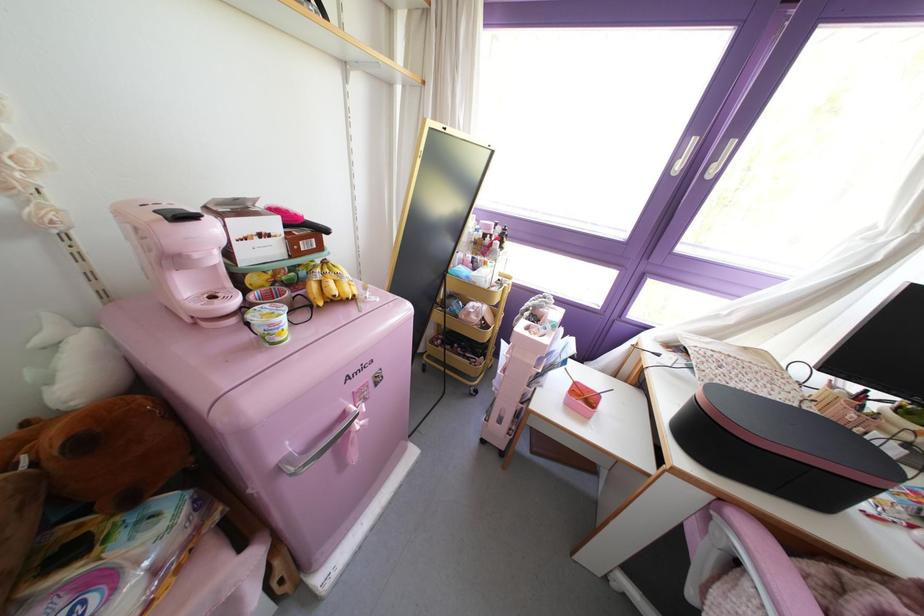
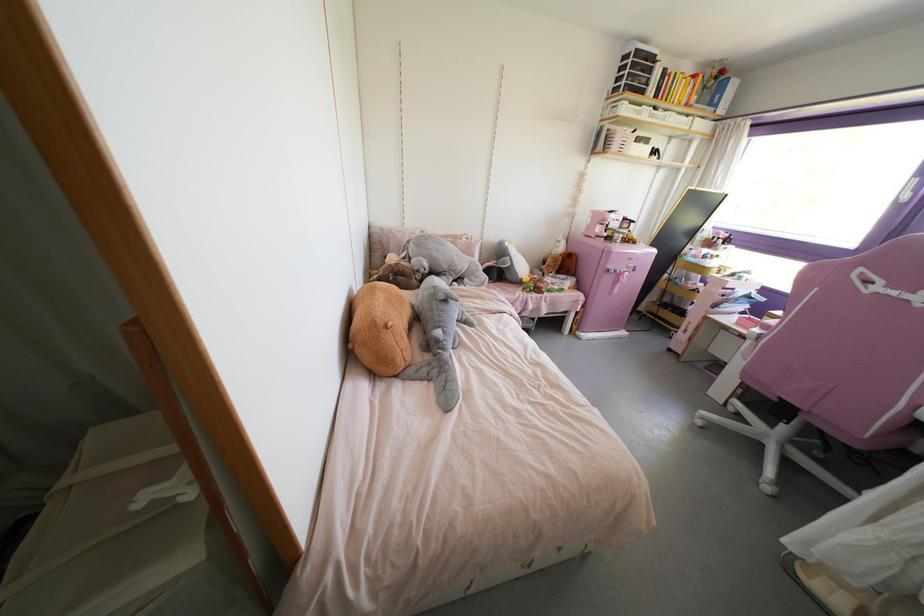
The point at [375,384] is marked in the first image. Where is the corresponding point in the second image?

(633, 270)